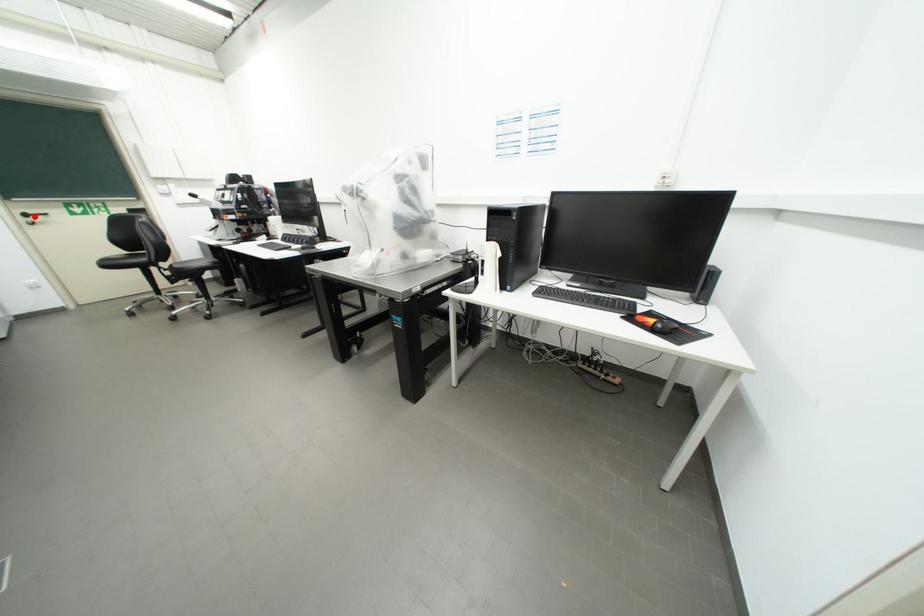
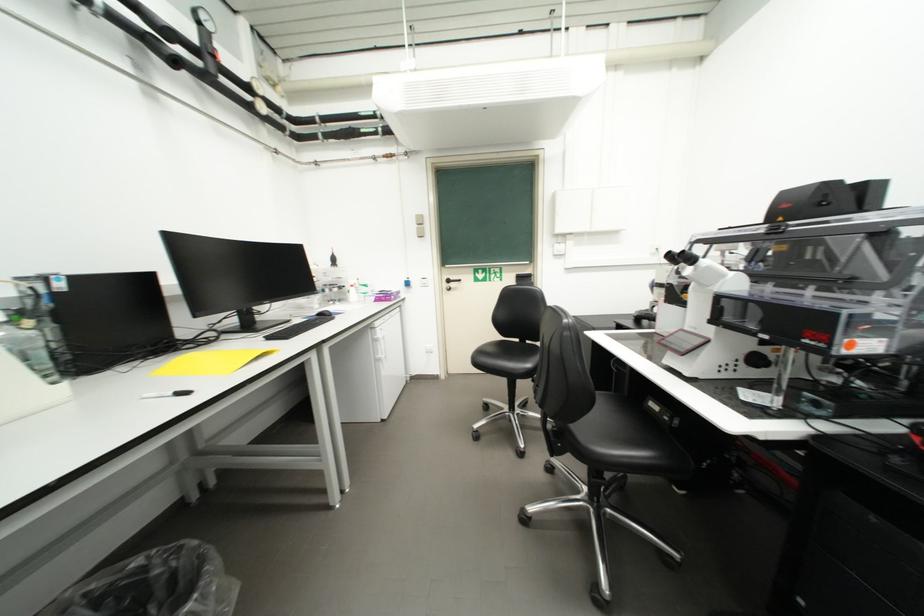
Question: I am providing you with two images of the same scene from different viewpoints. Image1 has a red point marked. In image2, the corresponding 3D location appears at what relative position? Reply with the corresponding letter.

Choices:
 (A) Closer
 (B) Farther

Answer: (A)